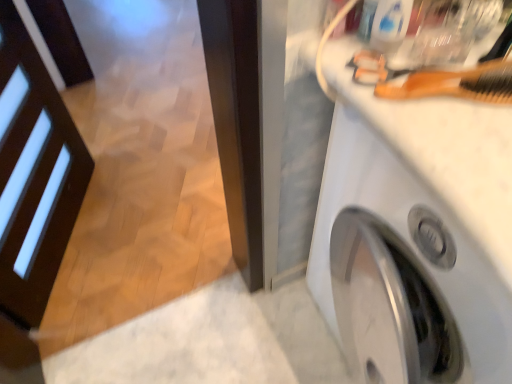
The image size is (512, 384). Identify the location of free point to the left of wooden comb at upper right. (361, 91).